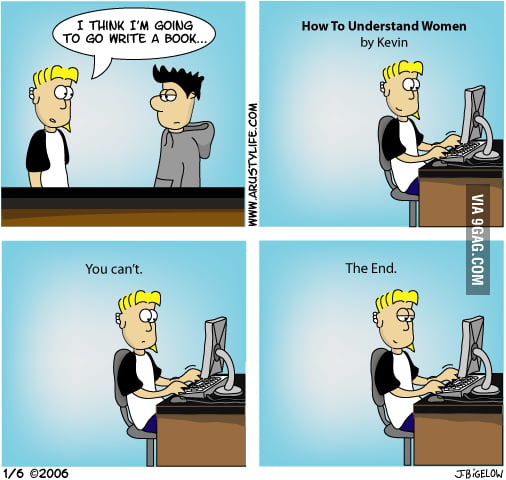
At what (x,y) coordinates should I click in order to perform the action: click on computer monitor. Please return your answer as a coordinate pair (x, y). The height and width of the screenshot is (480, 506). Looking at the image, I should click on pyautogui.click(x=213, y=345), pyautogui.click(x=467, y=348), pyautogui.click(x=473, y=104).